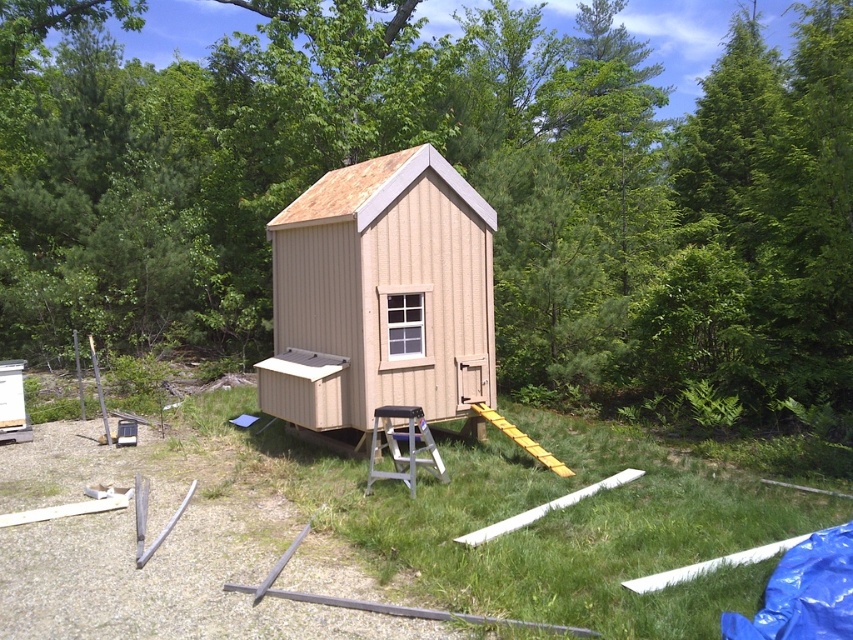
Consider the image. You are a gardener who wants to plant a new tree sapling. The sapling requires a minimum of 1.5 meters of vertical space to grow properly. Given the green leafy tree at center and the yellow plastic ramp at center, which object would be more suitable as a reference point for ensuring the sapling has enough vertical space?

The green leafy tree at center has a greater height compared to the yellow plastic ramp at center, so it would be a better reference point to ensure the sapling has the required 1.5 meters of vertical space.

You are a delivery person trying to reach the tan wood cabin at center. There is a yellow plastic ramp at center in the way. Which direction should you move to avoid the ramp and reach the cabin?

The tan wood cabin at center is to the left of the yellow plastic ramp at center, so you should move to the left to avoid the ramp and reach the cabin.

You are standing in a grassy area surrounded by greenery and want to reach the tan wood cabin at center. If your walking speed is 1.2 meters per second, how many seconds will it take you to reach the cabin?

The distance between you and the tan wood cabin at center is 7.91 meters. At a walking speed of 1.2 meters per second, dividing 7.91 by 1.2 gives approximately 6.59 seconds. Therefore, it will take roughly 6.6 seconds to reach the cabin.